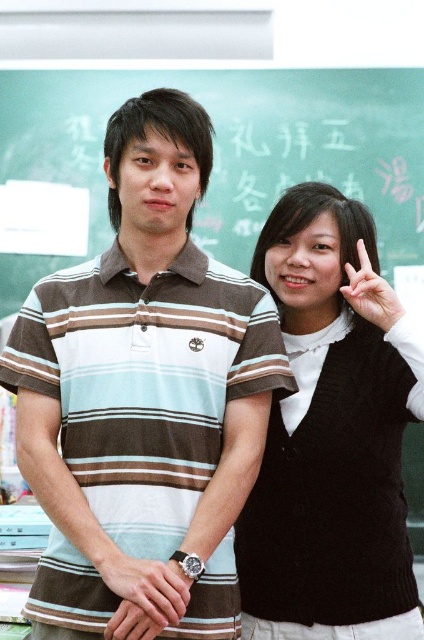
Does brown striped polo shirt at center appear on the right side of matte brown watch at center?

Indeed, brown striped polo shirt at center is positioned on the right side of matte brown watch at center.

Can you confirm if brown striped polo shirt at center is thinner than matte brown watch at center?

In fact, brown striped polo shirt at center might be wider than matte brown watch at center.

Is point (80, 349) positioned after point (139, 608)?

Yes.

Find the location of a particular element. brown striped polo shirt at center is located at coordinates coord(144,388).

What do you see at coordinates (148, 600) in the screenshot? This screenshot has width=424, height=640. I see `matte brown watch at center` at bounding box center [148, 600].

Who is higher up, matte brown watch at center or matte black hand at center?

Positioned higher is matte black hand at center.

The height and width of the screenshot is (640, 424). In order to click on matte brown watch at center in this screenshot , I will do `click(148, 600)`.

Between green chalkboard at upper center and matte brown watch at center, which one is positioned higher?

Positioned higher is green chalkboard at upper center.

The height and width of the screenshot is (640, 424). Identify the location of green chalkboard at upper center. (228, 150).

Locate an element on the screen. The height and width of the screenshot is (640, 424). green chalkboard at upper center is located at coordinates (228, 150).

You are a GUI agent. You are given a task and a screenshot of the screen. Output one action in this format:
    pyautogui.click(x=<x>, y=<y>)
    Task: Click on the green chalkboard at upper center
    Image resolution: width=424 pixels, height=640 pixels.
    Given the screenshot: What is the action you would take?
    pyautogui.click(x=228, y=150)